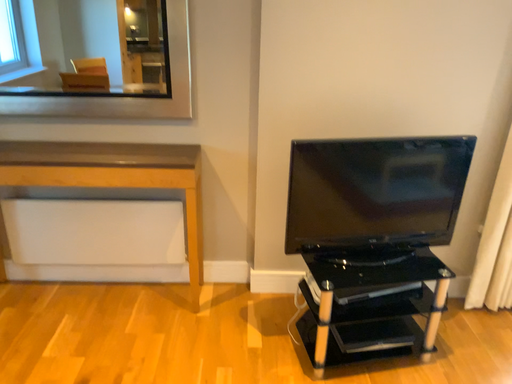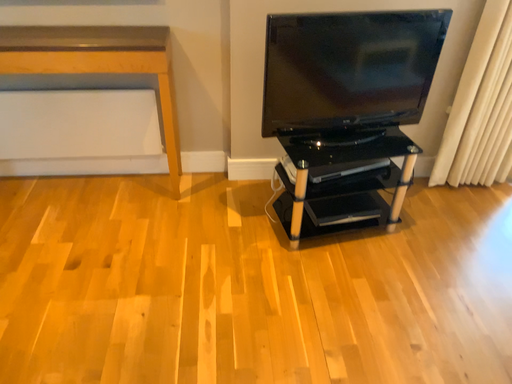
Question: How did the camera likely rotate when shooting the video?

Choices:
 (A) rotated upward
 (B) rotated downward

Answer: (B)